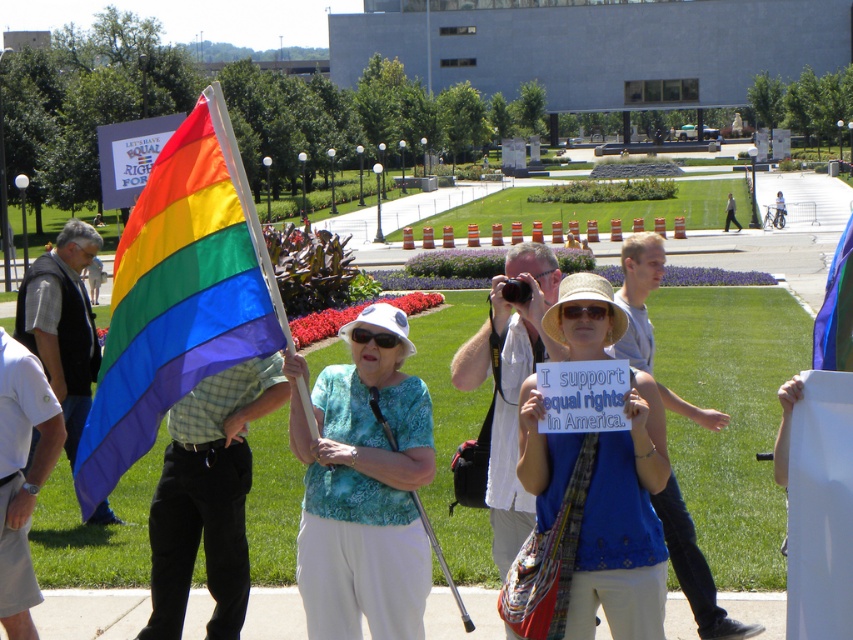
Question: Which object is farther from the camera taking this photo?

Choices:
 (A) blue fabric sign at center
 (B) white fabric hat at center

Answer: (B)

Question: Which point is closer to the camera taking this photo?

Choices:
 (A) (303, 560)
 (B) (119, 284)

Answer: (B)

Question: Considering the relative positions of white fabric hat at center and rainbow fabric flag at center in the image provided, where is white fabric hat at center located with respect to rainbow fabric flag at center?

Choices:
 (A) above
 (B) below

Answer: (B)

Question: Which of the following is the farthest from the observer?

Choices:
 (A) (657, 416)
 (B) (198, 278)
 (C) (372, 552)
 (D) (846, 324)

Answer: (C)

Question: Is white fabric hat at center above blue fabric sign at center?

Choices:
 (A) yes
 (B) no

Answer: (B)

Question: Does rainbow fabric flag at left appear over rainbow fabric flag at center?

Choices:
 (A) yes
 (B) no

Answer: (B)